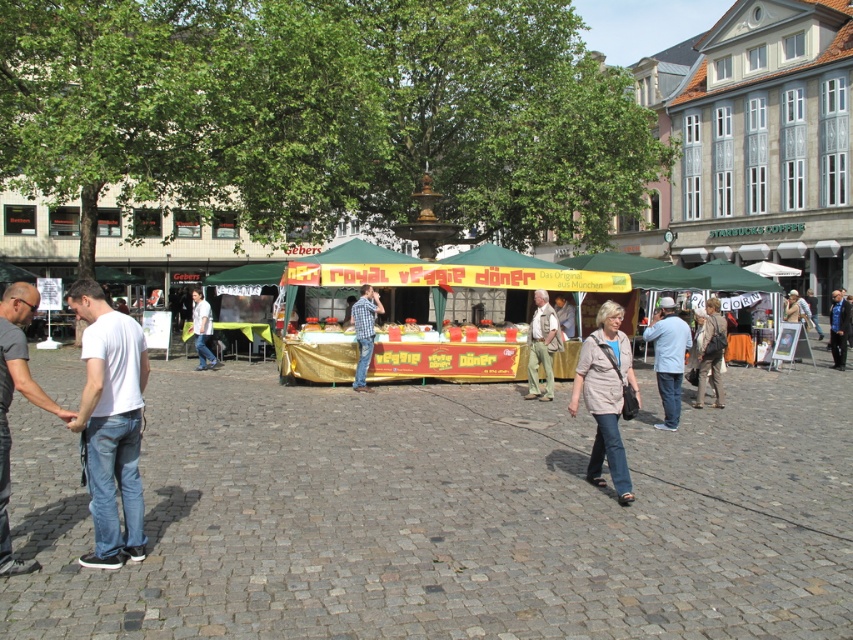
You are a vendor at the market and need to decide which clothing item to fold first. The matte brown jacket at center and the blue plaid shirt at center are both on the counter. Which item requires more space when folded due to its larger size?

The matte brown jacket at center requires more space when folded because its width surpasses that of the blue plaid shirt at center.

You are a customer at the ROYAL Veggie Doner stall and you want to wear both the light brown leather jacket at center and the white shirt at center. Which one should you put on first according to their thickness?

The light brown leather jacket at center is thinner than the white shirt at center, so you should put on the light brown leather jacket at center first before the white shirt at center.